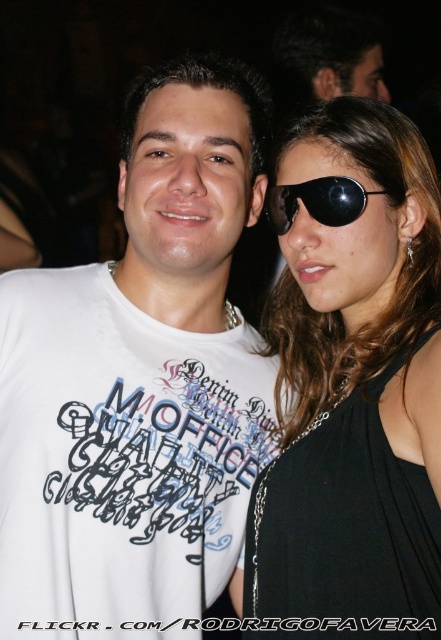
Question: Does white matte t-shirt at center have a smaller size compared to black plastic goggles at upper right?

Choices:
 (A) no
 (B) yes

Answer: (A)

Question: Which object is closer to the camera taking this photo?

Choices:
 (A) black plastic goggles at upper right
 (B) black matte sunglasses at upper right
 (C) white matte t-shirt at center

Answer: (B)

Question: Does white matte t-shirt at center have a greater width compared to black matte sunglasses at upper right?

Choices:
 (A) yes
 (B) no

Answer: (A)

Question: Among these objects, which one is farthest from the camera?

Choices:
 (A) white matte t-shirt at center
 (B) black plastic goggles at upper right

Answer: (B)

Question: Does white matte t-shirt at center appear under black plastic goggles at upper right?

Choices:
 (A) yes
 (B) no

Answer: (A)

Question: Among these objects, which one is farthest from the camera?

Choices:
 (A) white matte t-shirt at center
 (B) black matte sunglasses at upper right
 (C) black plastic goggles at upper right

Answer: (C)